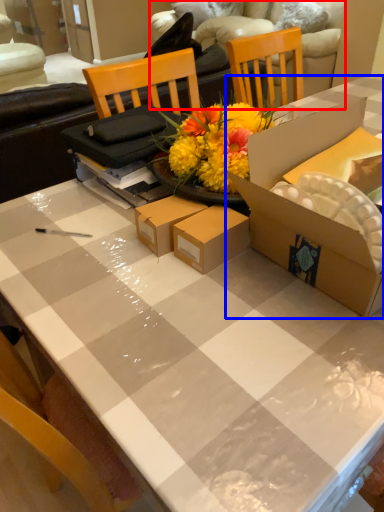
Question: Which of the following is the farthest to the observer, couch (highlighted by a red box) or box (highlighted by a blue box)?

Choices:
 (A) couch
 (B) box

Answer: (A)